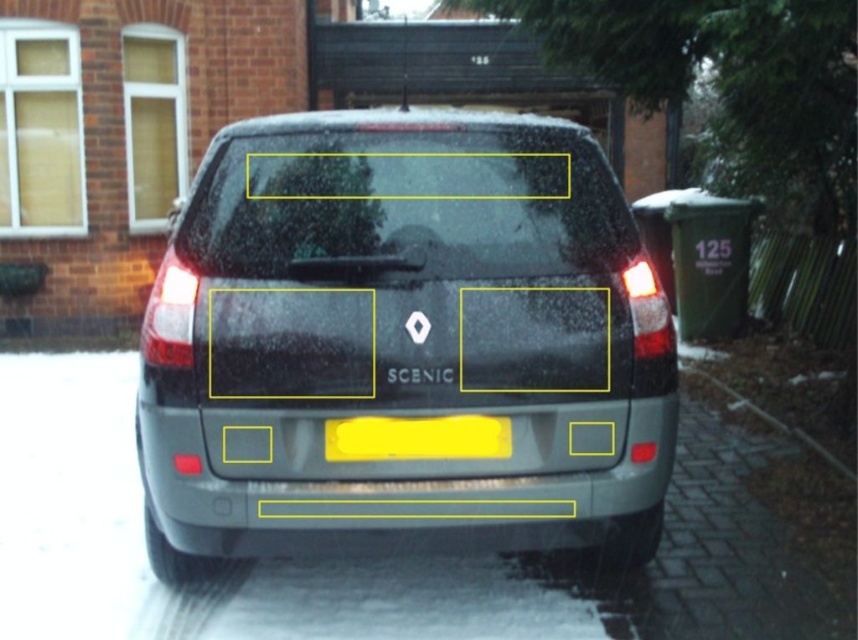
Who is more forward, (556, 236) or (366, 422)?

Point (366, 422) is more forward.

Is transparent glass windshield at upper center taller than yellow matte license plate at center?

Correct, transparent glass windshield at upper center is much taller as yellow matte license plate at center.

Is point (509, 221) in front of point (412, 460)?

That is False.

Locate an element on the screen. This screenshot has width=858, height=640. transparent glass windshield at upper center is located at coordinates (399, 212).

Is point (173, 557) positioned in front of point (446, 182)?

No, (173, 557) is further to viewer.

Based on the photo, does satin silver car at center appear on the right side of transparent glass windshield at upper center?

Incorrect, satin silver car at center is not on the right side of transparent glass windshield at upper center.

The image size is (858, 640). Find the location of `satin silver car at center`. satin silver car at center is located at coordinates (403, 340).

Between satin silver car at center and yellow matte license plate at center, which one is positioned lower?

yellow matte license plate at center is lower down.

Which is in front, point (204, 236) or point (414, 445)?

Point (414, 445) is more forward.

Who is more distant from viewer, (536, 182) or (343, 456)?

Point (536, 182)

Locate an element on the screen. Image resolution: width=858 pixels, height=640 pixels. satin silver car at center is located at coordinates (403, 340).